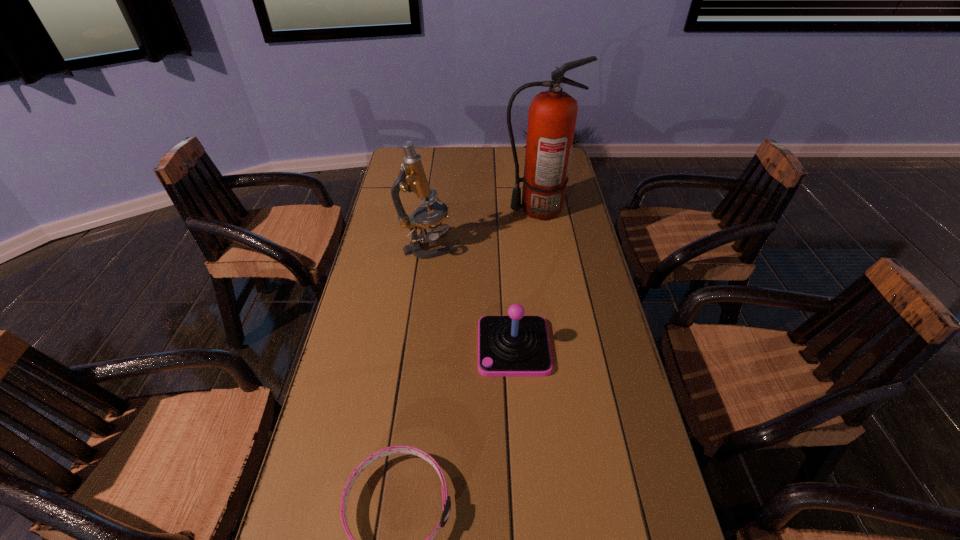
Image resolution: width=960 pixels, height=540 pixels. I want to click on vacant space in between the third tallest object and the microscope, so click(x=470, y=297).

The width and height of the screenshot is (960, 540). What are the coordinates of `free space between the second tallest object and the third tallest object` in the screenshot? It's located at (470, 297).

Where is `vacant region between the microscope and the fire extinguisher`? The height and width of the screenshot is (540, 960). vacant region between the microscope and the fire extinguisher is located at coordinates (483, 228).

Find the location of `free space between the third farthest object and the microscope`. free space between the third farthest object and the microscope is located at coordinates (470, 297).

Identify the location of vacant region between the second nearest object and the second tallest object. The height and width of the screenshot is (540, 960). (470, 297).

Point out which object is positioned as the nearest to the joystick. Please provide its 2D coordinates. Your answer should be formatted as a tuple, i.e. [(x, y)], where the tuple contains the x and y coordinates of a point satisfying the conditions above.

[(398, 449)]

Identify the location of the third closest object to the second nearest object. This screenshot has height=540, width=960. (552, 115).